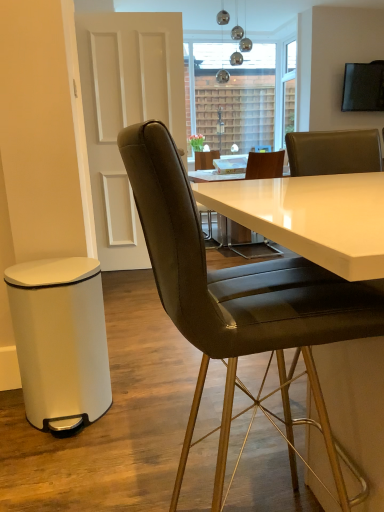
Question: Is white matte bar stool at lower left shorter than leather/goldenchair at center?

Choices:
 (A) no
 (B) yes

Answer: (B)

Question: Is white matte bar stool at lower left thinner than leather/goldenchair at center?

Choices:
 (A) no
 (B) yes

Answer: (B)

Question: Can you confirm if white matte bar stool at lower left is taller than leather/goldenchair at center?

Choices:
 (A) no
 (B) yes

Answer: (A)

Question: Is white matte bar stool at lower left positioned behind leather/goldenchair at center?

Choices:
 (A) no
 (B) yes

Answer: (B)

Question: Does white matte bar stool at lower left contain leather/goldenchair at center?

Choices:
 (A) no
 (B) yes

Answer: (A)

Question: From the image's perspective, is white glossy door at upper left above or below leather/goldenchair at center?

Choices:
 (A) below
 (B) above

Answer: (B)

Question: Considering the positions of white glossy door at upper left and leather/goldenchair at center in the image, is white glossy door at upper left taller or shorter than leather/goldenchair at center?

Choices:
 (A) tall
 (B) short

Answer: (A)

Question: From a real-world perspective, relative to leather/goldenchair at center, is white glossy door at upper left vertically above or below?

Choices:
 (A) above
 (B) below

Answer: (A)

Question: Looking at their shapes, would you say white glossy door at upper left is wider or thinner than leather/goldenchair at center?

Choices:
 (A) thin
 (B) wide

Answer: (A)

Question: In terms of width, does leather/goldenchair at center look wider or thinner when compared to white matte bar stool at lower left?

Choices:
 (A) wide
 (B) thin

Answer: (A)

Question: Which is correct: leather/goldenchair at center is inside white matte bar stool at lower left, or outside of it?

Choices:
 (A) inside
 (B) outside

Answer: (B)

Question: Is leather/goldenchair at center bigger or smaller than white matte bar stool at lower left?

Choices:
 (A) small
 (B) big

Answer: (B)

Question: From a real-world perspective, relative to white matte bar stool at lower left, is leather/goldenchair at center vertically above or below?

Choices:
 (A) below
 (B) above

Answer: (B)

Question: From the image's perspective, is leather/goldenchair at center above or below white glossy door at upper left?

Choices:
 (A) below
 (B) above

Answer: (A)

Question: From a real-world perspective, is leather/goldenchair at center positioned above or below white glossy door at upper left?

Choices:
 (A) above
 (B) below

Answer: (B)